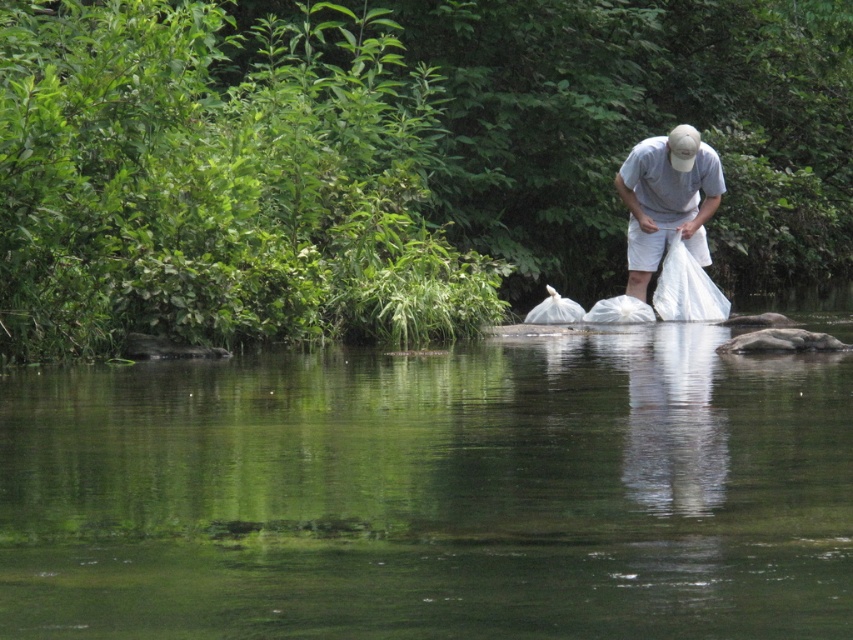
Question: Which point is closer to the camera taking this photo?

Choices:
 (A) (640, 294)
 (B) (641, 467)

Answer: (B)

Question: Is clear water at river center wider than white fabric bag at center?

Choices:
 (A) yes
 (B) no

Answer: (A)

Question: Which point is farther to the camera?

Choices:
 (A) (329, 604)
 (B) (637, 272)

Answer: (B)

Question: Is clear water at river center wider than white fabric bag at center?

Choices:
 (A) yes
 (B) no

Answer: (A)

Question: Among these points, which one is farthest from the camera?

Choices:
 (A) [700, 170]
 (B) [738, 589]

Answer: (A)

Question: Is clear water at river center above white fabric bag at center?

Choices:
 (A) no
 (B) yes

Answer: (A)